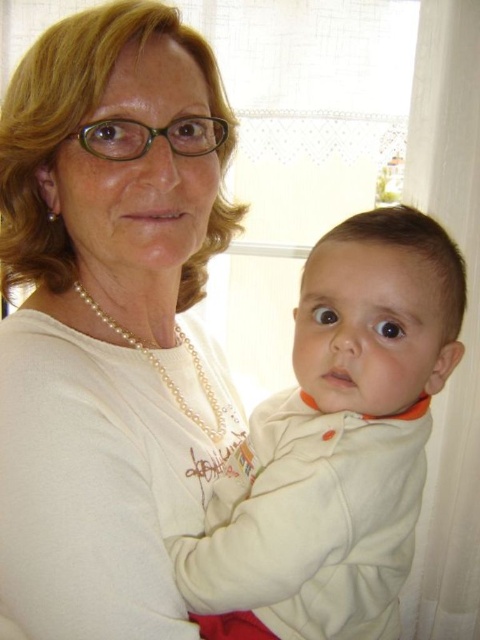
Between point (307, 333) and point (187, 406), which one is positioned in front?

Positioned in front is point (307, 333).

Between white fleece baby at center and pearl necklace at upper center, which one is positioned lower?

Positioned lower is white fleece baby at center.

Is point (405, 300) in front of point (127, 339)?

That is True.

I want to click on white fleece baby at center, so click(x=336, y=445).

Is pearl necklace at center smaller than white fleece baby at center?

No.

Where is `pearl necklace at center`? pearl necklace at center is located at coordinates (108, 321).

You are a GUI agent. You are given a task and a screenshot of the screen. Output one action in this format:
    pyautogui.click(x=<x>, y=<y>)
    Task: Click on the pearl necklace at center
    
    Given the screenshot: What is the action you would take?
    pyautogui.click(x=108, y=321)

The image size is (480, 640). What do you see at coordinates (108, 321) in the screenshot?
I see `pearl necklace at center` at bounding box center [108, 321].

Is point (139, 216) behind point (169, 380)?

No, (139, 216) is in front of (169, 380).

Consider the image. Who is more distant from viewer, [85,282] or [163,378]?

The point [163,378] is behind.

The image size is (480, 640). I want to click on pearl necklace at center, so click(x=108, y=321).